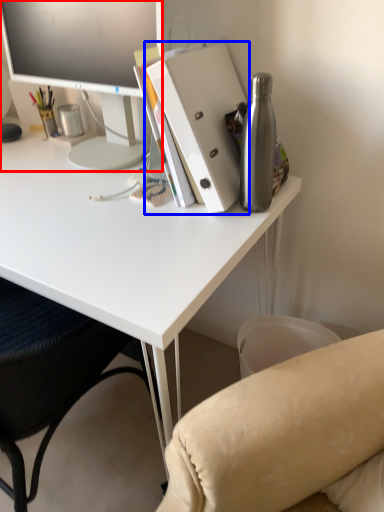
Question: Among these objects, which one is farthest to the camera, television (highlighted by a red box) or paperback book (highlighted by a blue box)?

Choices:
 (A) television
 (B) paperback book

Answer: (A)